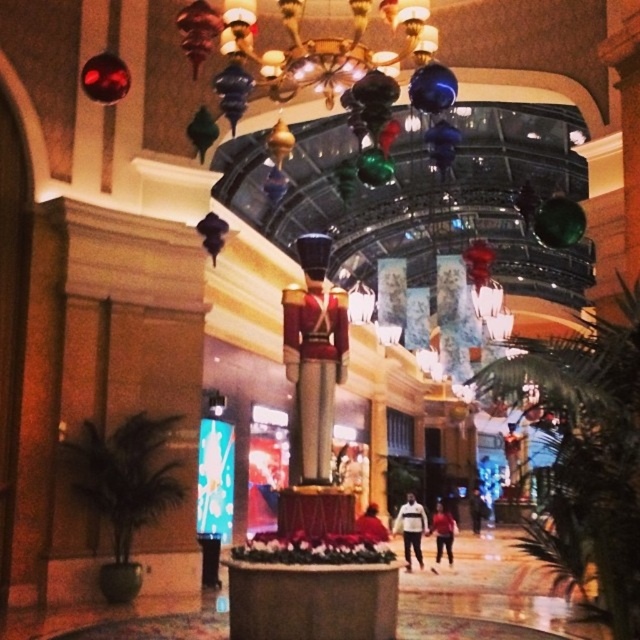
Is white matte jacket at center bigger than red fabric jacket at center?

Actually, white matte jacket at center might be smaller than red fabric jacket at center.

Does point (419, 554) come in front of point (435, 556)?

That is True.

Measure the distance between white matte jacket at center and camera.

white matte jacket at center and camera are 56.18 feet apart.

Locate an element on the screen. This screenshot has width=640, height=640. white matte jacket at center is located at coordinates (410, 529).

Does red fabric jacket at center appear on the left side of dark blue fabric jacket at center?

Yes, red fabric jacket at center is to the left of dark blue fabric jacket at center.

Who is lower down, red fabric jacket at center or dark blue fabric jacket at center?

Positioned lower is dark blue fabric jacket at center.

Does point (433, 515) come in front of point (474, 500)?

Yes, point (433, 515) is closer to viewer.

You are a GUI agent. You are given a task and a screenshot of the screen. Output one action in this format:
    pyautogui.click(x=<x>, y=<y>)
    Task: Click on the red fabric jacket at center
    The width and height of the screenshot is (640, 640).
    Given the screenshot: What is the action you would take?
    pyautogui.click(x=442, y=532)

Is point (413, 509) less distant than point (470, 496)?

Yes, it is.

Is point (410, 504) positioned in front of point (472, 516)?

Yes.

Find the location of a particular element. white matte jacket at center is located at coordinates (410, 529).